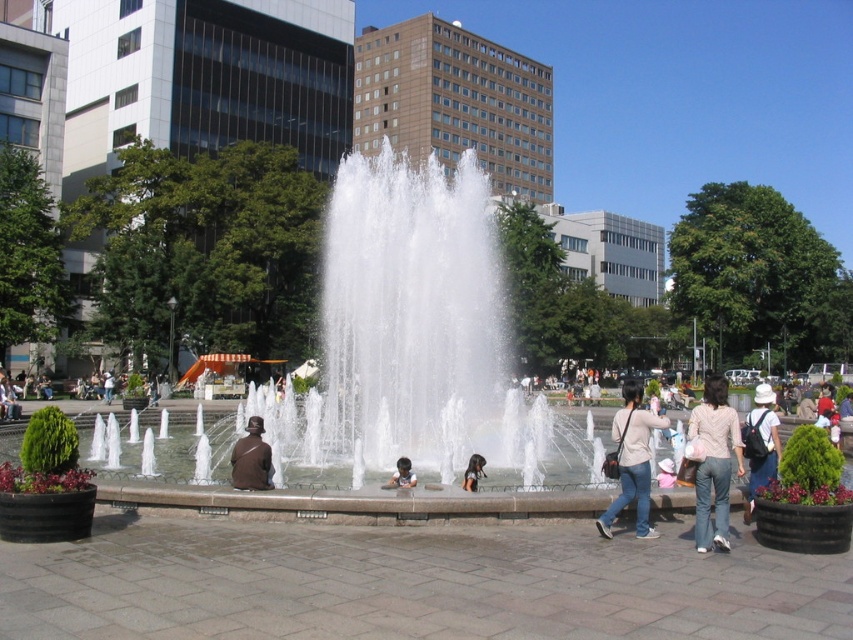
Is white fabric hat at center to the right of smooth brown hair at center from the viewer's perspective?

Indeed, white fabric hat at center is positioned on the right side of smooth brown hair at center.

Can you confirm if white fabric hat at center is thinner than smooth brown hair at center?

In fact, white fabric hat at center might be wider than smooth brown hair at center.

Who is more distant from viewer, (x=769, y=419) or (x=483, y=476)?

The point (x=483, y=476) is more distant.

Locate an element on the screen. The image size is (853, 640). white fabric hat at center is located at coordinates (759, 444).

Which is in front, point (767, 429) or point (257, 436)?

Point (767, 429) is more forward.

Can you confirm if white fabric hat at center is positioned to the right of brown leather jacket at center?

Indeed, white fabric hat at center is positioned on the right side of brown leather jacket at center.

Who is more forward, (753, 426) or (247, 436)?

Point (753, 426)

Find the location of a particular element. The image size is (853, 640). white fabric hat at center is located at coordinates (759, 444).

Who is more distant from viewer, (630, 468) or (259, 483)?

Point (259, 483)

Can you confirm if matte beige bag at center is bigger than brown leather jacket at center?

Indeed, matte beige bag at center has a larger size compared to brown leather jacket at center.

Which is behind, point (624, 416) or point (231, 460)?

Positioned behind is point (231, 460).

At what (x,y) coordinates should I click in order to perform the action: click on matte beige bag at center. Please return your answer as a coordinate pair (x, y). Looking at the image, I should click on (631, 460).